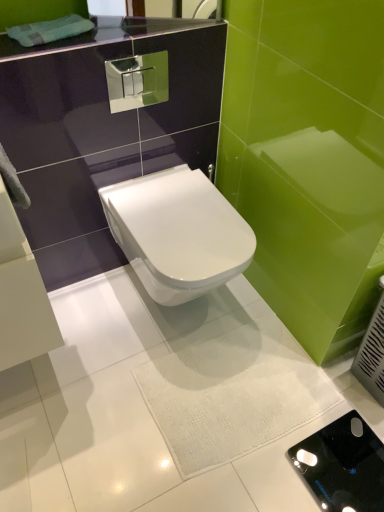
This screenshot has width=384, height=512. Identify the location of vacant space situated on the left part of black glossy porcelain at center. (270, 452).